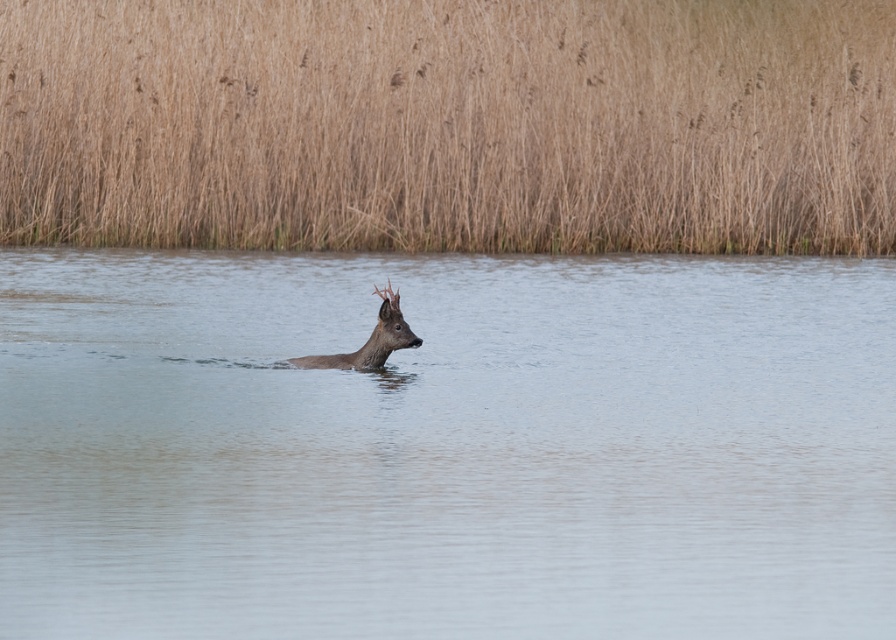
You are an environmental scientist observing the scene. You need to determine the spatial relationship between the brown grass at upper center and the brown matte deer at center. Which object is wider?

The brown grass at upper center is wider than the brown matte deer at center.

You are an observer standing at the edge of the water. You want to cross to the other side but must avoid stepping on the brown matte deer at center. Given the clear water at center is wider than the deer, can you safely walk around the deer without getting too close? Please explain.

The clear water at center is wider than the brown matte deer at center, so you can safely walk around the deer by staying within the wider area of the clear water at center to avoid getting too close.

You are standing in the scene and want to locate the brown grass at upper center. What are the coordinates where you can find it?

The brown grass at upper center can be found at coordinates point [450,125].